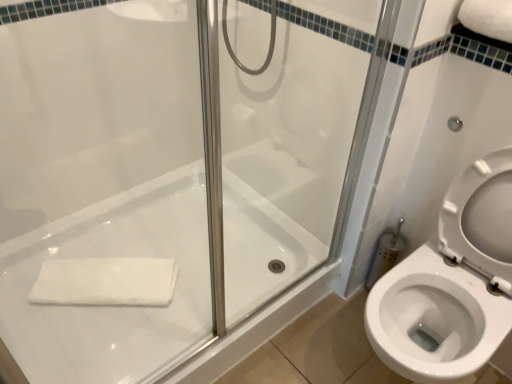
Question: Does white cotton bath towel at lower left, which appears as the first bath towel when ordered from the bottom, have a smaller size compared to white glossy bath at center?

Choices:
 (A) no
 (B) yes

Answer: (B)

Question: Is white cotton bath towel at lower left, which appears as the first bath towel when ordered from the bottom, behind white glossy bath at center?

Choices:
 (A) yes
 (B) no

Answer: (A)

Question: Is white cotton bath towel at lower left, which appears as the first bath towel when ordered from the bottom, facing towards white glossy bath at center?

Choices:
 (A) no
 (B) yes

Answer: (B)

Question: Can you confirm if white cotton bath towel at lower left, which appears as the first bath towel when ordered from the bottom, is taller than white glossy bath at center?

Choices:
 (A) yes
 (B) no

Answer: (B)

Question: Can you confirm if white cotton bath towel at lower left, which appears as the first bath towel when ordered from the bottom, is bigger than white glossy bath at center?

Choices:
 (A) yes
 (B) no

Answer: (B)

Question: From a real-world perspective, does white cotton bath towel at lower left, which appears as the first bath towel when ordered from the bottom, sit lower than white glossy bath at center?

Choices:
 (A) yes
 (B) no

Answer: (B)

Question: Considering the relative positions of white soft towel at upper right, arranged as the first bath towel when viewed from the right, and white glossy bath at center in the image provided, is white soft towel at upper right, arranged as the first bath towel when viewed from the right, to the right of white glossy bath at center from the viewer's perspective?

Choices:
 (A) no
 (B) yes

Answer: (B)

Question: Does white soft towel at upper right, arranged as the first bath towel when viewed from the right, have a lesser width compared to white glossy bath at center?

Choices:
 (A) yes
 (B) no

Answer: (A)

Question: Considering the relative sizes of white soft towel at upper right, acting as the 1th bath towel starting from the front, and white glossy bath at center in the image provided, is white soft towel at upper right, acting as the 1th bath towel starting from the front, wider than white glossy bath at center?

Choices:
 (A) yes
 (B) no

Answer: (B)

Question: Is white soft towel at upper right, acting as the 2th bath towel starting from the back, in front of white glossy bath at center?

Choices:
 (A) yes
 (B) no

Answer: (A)

Question: Considering the relative sizes of white soft towel at upper right, the first bath towel in the top-to-bottom sequence, and white glossy bath at center in the image provided, is white soft towel at upper right, the first bath towel in the top-to-bottom sequence, taller than white glossy bath at center?

Choices:
 (A) yes
 (B) no

Answer: (B)

Question: From the image's perspective, is white soft towel at upper right, the first bath towel in the top-to-bottom sequence, over white glossy bath at center?

Choices:
 (A) yes
 (B) no

Answer: (A)

Question: Considering the relative positions of white cotton bath towel at lower left, arranged as the second bath towel when viewed from the top, and white soft towel at upper right, the first bath towel in the top-to-bottom sequence, in the image provided, is white cotton bath towel at lower left, arranged as the second bath towel when viewed from the top, to the left of white soft towel at upper right, the first bath towel in the top-to-bottom sequence, from the viewer's perspective?

Choices:
 (A) no
 (B) yes

Answer: (B)